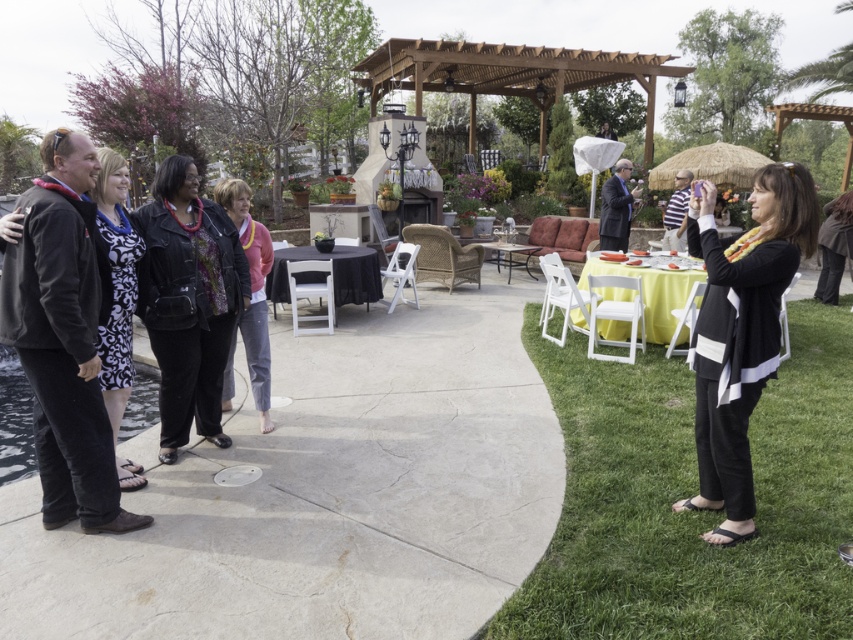
Who is taller, black matte jacket at right or black leather jacket at center?

black leather jacket at center

Is point (705, 492) positioned after point (219, 289)?

No.

What are the coordinates of `black matte jacket at right` in the screenshot? It's located at (741, 332).

Is black leather jacket at center to the right of pink fabric jacket at center from the viewer's perspective?

Incorrect, black leather jacket at center is not on the right side of pink fabric jacket at center.

Can you confirm if black leather jacket at center is positioned above pink fabric jacket at center?

No, black leather jacket at center is not above pink fabric jacket at center.

Is point (196, 180) closer to viewer compared to point (264, 333)?

No, (196, 180) is behind (264, 333).

The width and height of the screenshot is (853, 640). Identify the location of black leather jacket at center. (189, 296).

Can you confirm if black matte jacket at right is shorter than pink fabric jacket at center?

Incorrect, black matte jacket at right's height does not fall short of pink fabric jacket at center's.

Is point (762, 339) less distant than point (248, 323)?

Yes, it is in front of point (248, 323).

The width and height of the screenshot is (853, 640). I want to click on black matte jacket at right, so click(x=741, y=332).